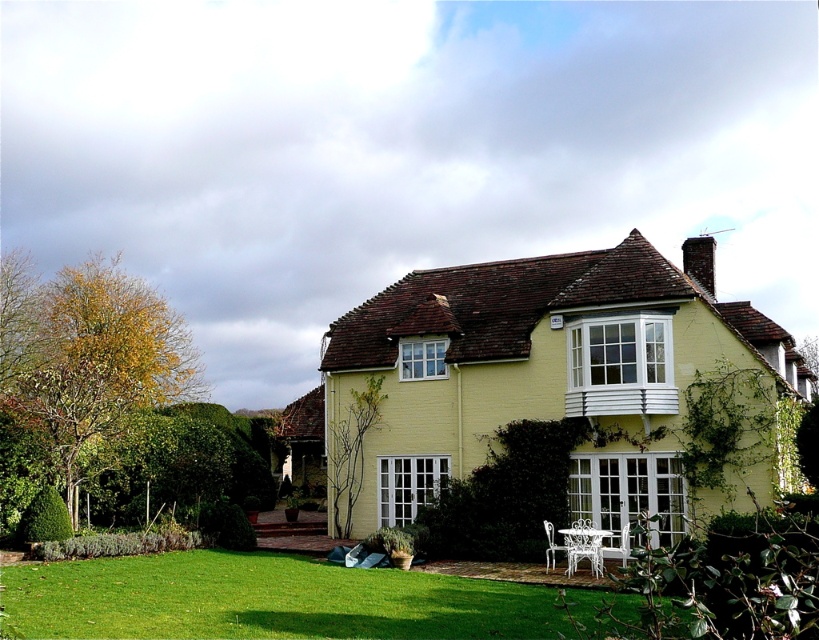
Between point (492, 589) and point (532, 516), which one is positioned in front?

Point (492, 589) is more forward.

Consider the image. Between green grass at lower center and green leafy hedge at center, which one has more height?

green grass at lower center

Image resolution: width=819 pixels, height=640 pixels. Describe the element at coordinates (265, 600) in the screenshot. I see `green grass at lower center` at that location.

Locate an element on the screen. The width and height of the screenshot is (819, 640). green grass at lower center is located at coordinates (265, 600).